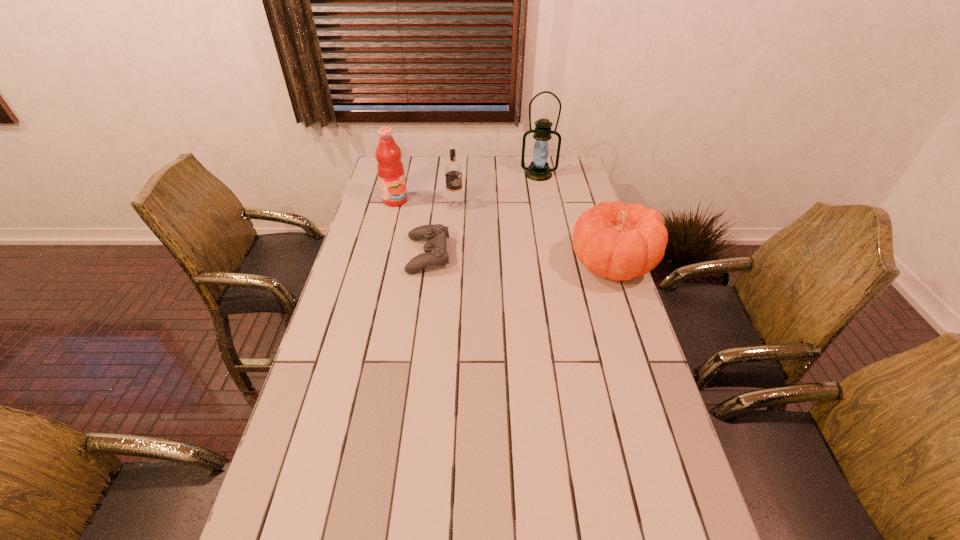
Find the location of `free space located on the front label of the second tallest object`. free space located on the front label of the second tallest object is located at coordinates (425, 214).

Locate an element on the screen. Image resolution: width=960 pixels, height=540 pixels. vacant position located 0.310m on the front label of the second tallest object is located at coordinates (468, 232).

You are a GUI agent. You are given a task and a screenshot of the screen. Output one action in this format:
    pyautogui.click(x=<x>, y=<y>)
    Task: Click on the free space located on the side where the tallest object emits light
    The image size is (960, 540).
    Given the screenshot: What is the action you would take?
    pyautogui.click(x=537, y=211)

This screenshot has width=960, height=540. What are the coordinates of `free space located 0.310m on the side where the tallest object emits light` in the screenshot? It's located at (537, 224).

You are a GUI agent. You are given a task and a screenshot of the screen. Output one action in this format:
    pyautogui.click(x=<x>, y=<y>)
    Task: Click on the vacant space situated on the side where the tallest object emits light
    
    Given the screenshot: What is the action you would take?
    pyautogui.click(x=537, y=200)

Locate an element on the screen. Image resolution: width=960 pixels, height=540 pixels. free space located 0.390m on the label of the third shortest object is located at coordinates (533, 258).

You are a GUI agent. You are given a task and a screenshot of the screen. Output one action in this format:
    pyautogui.click(x=<x>, y=<y>)
    Task: Click on the vacant space located 0.220m on the label of the third shortest object
    The height and width of the screenshot is (540, 960).
    Given the screenshot: What is the action you would take?
    pyautogui.click(x=499, y=235)

Where is `free space located on the label of the third shortest object`? This screenshot has height=540, width=960. free space located on the label of the third shortest object is located at coordinates (472, 217).

I want to click on object located at the far edge, so click(538, 170).

Identify the location of object located at the left edge. (390, 168).